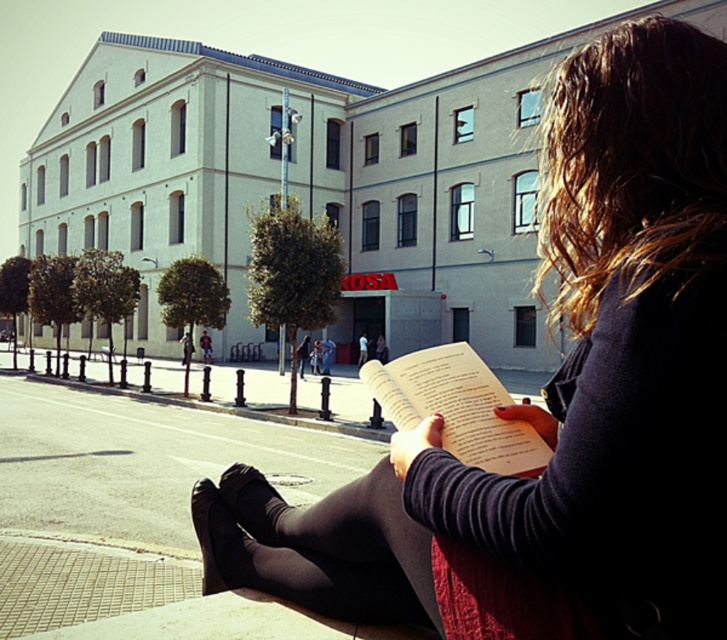
You are a delivery person who needs to place a matte black book at center. The coordinates given are point [555,403]. Where should you place the matte black book at center?

Place the matte black book at center at point [555,403] as specified.